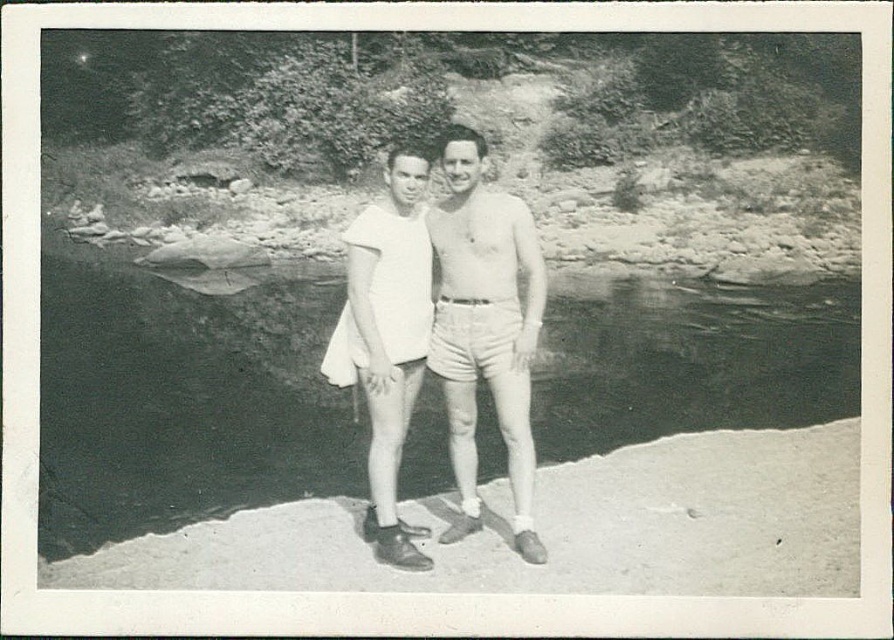
Question: Does black water at center appear under white cotton shirt at center?

Choices:
 (A) yes
 (B) no

Answer: (A)

Question: Can you confirm if black water at center is positioned to the left of white cotton shirt at center?

Choices:
 (A) no
 (B) yes

Answer: (B)

Question: Which point is farther from the camera taking this photo?

Choices:
 (A) (749, 307)
 (B) (469, 470)

Answer: (A)

Question: Which of the following is the closest to the observer?

Choices:
 (A) (482, 259)
 (B) (301, 460)

Answer: (A)

Question: Can you confirm if black water at center is positioned above white cotton shirt at center?

Choices:
 (A) yes
 (B) no

Answer: (B)

Question: Which point is farther from the camera taking this photo?

Choices:
 (A) (817, 380)
 (B) (449, 444)

Answer: (A)